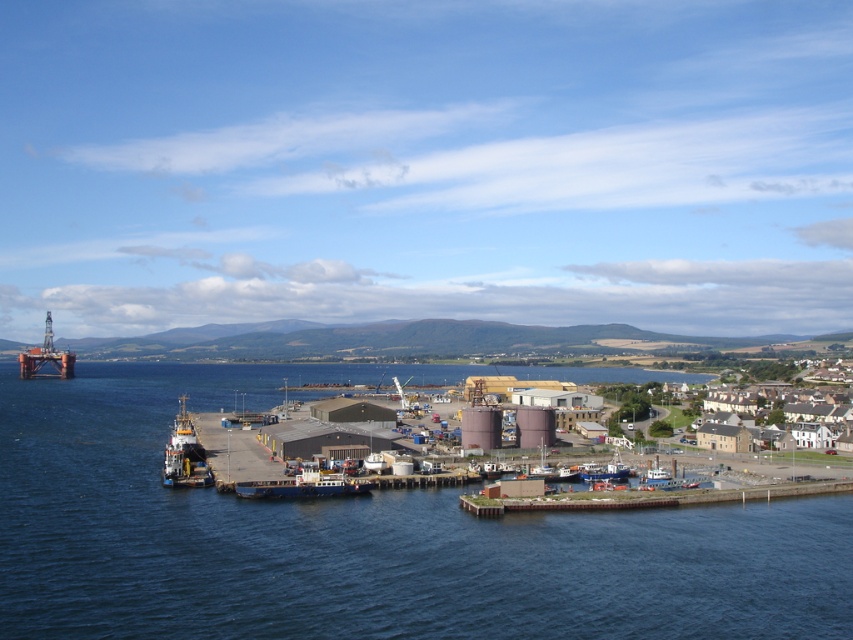
Question: Estimate the real-world distances between objects in this image. Which object is closer to the blue matte ship at center?

Choices:
 (A) metallic gray boat at lower left
 (B) blue water at lower left

Answer: (A)

Question: Which object is positioned farthest from the white plastic boat at lower right?

Choices:
 (A) blue matte ship at center
 (B) brown concrete dock at lower right

Answer: (A)

Question: Does brown stone houses at lower right lie in front of brown concrete dock at lower right?

Choices:
 (A) yes
 (B) no

Answer: (B)

Question: Is brown stone houses at lower right above brown concrete dock at lower right?

Choices:
 (A) no
 (B) yes

Answer: (B)

Question: Among these objects, which one is farthest from the camera?

Choices:
 (A) white plastic boat at lower right
 (B) brown concrete dock at lower right
 (C) metallic blue boat at lower center

Answer: (C)

Question: Observing the image, what is the correct spatial positioning of metallic gray boat at lower left in reference to metallic blue boat at lower center?

Choices:
 (A) below
 (B) above

Answer: (B)